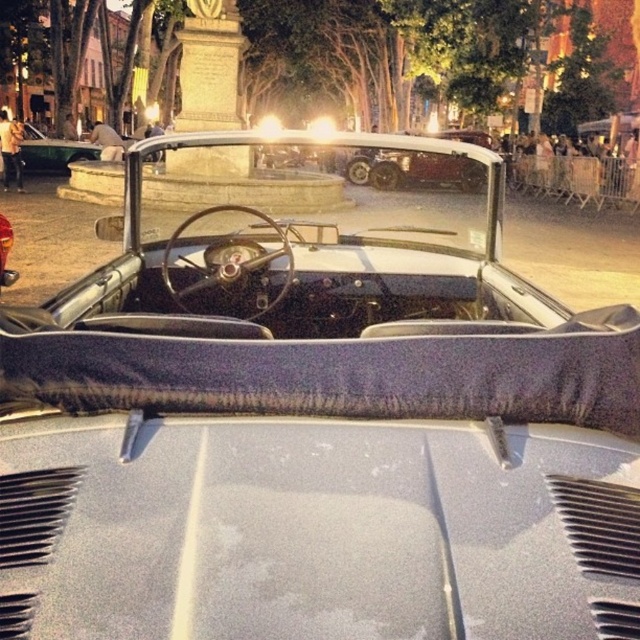
Does point (272, 164) come farther from viewer compared to point (22, 163)?

That is True.

This screenshot has height=640, width=640. What are the coordinates of `clear glass windshield at center` in the screenshot? It's located at (316, 177).

Locate an element on the screen. The width and height of the screenshot is (640, 640). clear glass windshield at center is located at coordinates (316, 177).